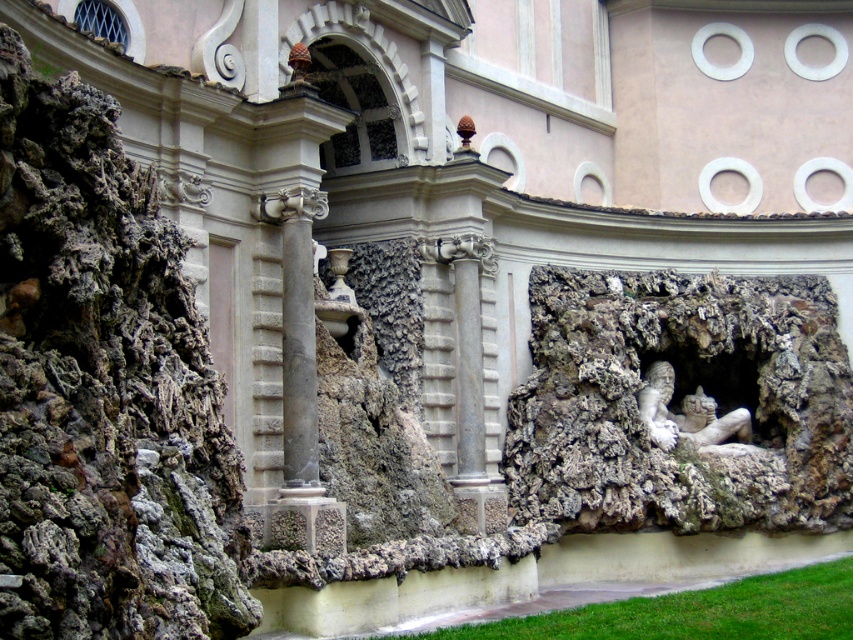
Is rough stone rock at center thinner than rough stone carving at center?

Yes, rough stone rock at center is thinner than rough stone carving at center.

Which is more to the left, rough stone rock at center or rough stone carving at center?

rough stone rock at center is more to the left.

Identify the location of rough stone rock at center. (103, 388).

Is rough stone rock at center above white stone reclining figure at center-right?

Correct, rough stone rock at center is located above white stone reclining figure at center-right.

Can you confirm if rough stone rock at center is taller than white stone reclining figure at center-right?

Indeed, rough stone rock at center has a greater height compared to white stone reclining figure at center-right.

At what (x,y) coordinates should I click in order to perform the action: click on rough stone rock at center. Please return your answer as a coordinate pair (x, y). The height and width of the screenshot is (640, 853). Looking at the image, I should click on (103, 388).

Which is above, rough stone carving at center or white stone reclining figure at center-right?

rough stone carving at center

Is rough stone carving at center positioned behind white stone reclining figure at center-right?

No, it is not.

Between point (688, 456) and point (662, 428), which one is positioned behind?

The point (688, 456) is more distant.

Where is `rough stone carving at center`? rough stone carving at center is located at coordinates (680, 403).